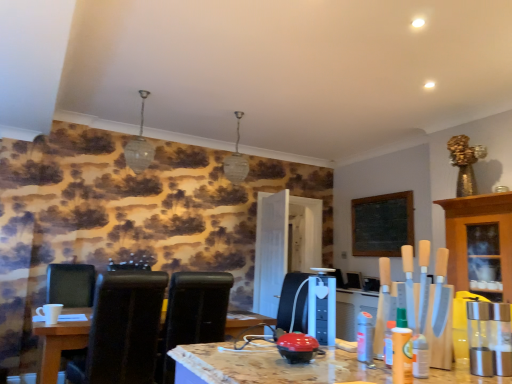
Question: Would you say black leather chair at lower left, the 1th chair from the left, is outside black leather chair at left, placed as the 2th chair when sorted from right to left?

Choices:
 (A) yes
 (B) no

Answer: (A)

Question: Can you confirm if black leather chair at lower left, the 1th chair from the left, is positioned to the right of black leather chair at left, placed as the 2th chair when sorted from right to left?

Choices:
 (A) no
 (B) yes

Answer: (A)

Question: Is black leather chair at left, placed as the 2th chair when sorted from right to left, located within black leather chair at lower left, the third chair from the right?

Choices:
 (A) yes
 (B) no

Answer: (B)

Question: Does black leather chair at lower left, the third chair from the right, have a smaller size compared to black leather chair at left, arranged as the 2th chair when viewed from the left?

Choices:
 (A) no
 (B) yes

Answer: (A)

Question: Does black leather chair at lower left, the third chair from the right, have a larger size compared to black leather chair at left, placed as the 2th chair when sorted from right to left?

Choices:
 (A) yes
 (B) no

Answer: (A)

Question: Considering the relative positions of wooden cabinet at right and wooden table at lower left in the image provided, is wooden cabinet at right to the left or to the right of wooden table at lower left?

Choices:
 (A) right
 (B) left

Answer: (A)

Question: Considering the positions of point (467, 216) and point (83, 327), is point (467, 216) closer or farther from the camera than point (83, 327)?

Choices:
 (A) closer
 (B) farther

Answer: (B)

Question: Looking at their shapes, would you say wooden cabinet at right is wider or thinner than wooden table at lower left?

Choices:
 (A) wide
 (B) thin

Answer: (B)

Question: From the image's perspective, is wooden cabinet at right located above or below wooden table at lower left?

Choices:
 (A) above
 (B) below

Answer: (A)

Question: In terms of height, does wooden cabinet at right look taller or shorter compared to black leather chair at lower left, the third chair from the right?

Choices:
 (A) short
 (B) tall

Answer: (A)

Question: Visually, is wooden cabinet at right positioned to the left or to the right of black leather chair at lower left, the 1th chair from the left?

Choices:
 (A) right
 (B) left

Answer: (A)

Question: From the image's perspective, is wooden cabinet at right positioned above or below black leather chair at lower left, the third chair from the right?

Choices:
 (A) below
 (B) above

Answer: (B)

Question: From a real-world perspective, is wooden cabinet at right physically located above or below black leather chair at lower left, the third chair from the right?

Choices:
 (A) below
 (B) above

Answer: (B)

Question: In terms of height, does wooden table at lower left look taller or shorter compared to wooden cabinet at right?

Choices:
 (A) tall
 (B) short

Answer: (B)

Question: Is wooden table at lower left situated inside wooden cabinet at right or outside?

Choices:
 (A) inside
 (B) outside

Answer: (B)